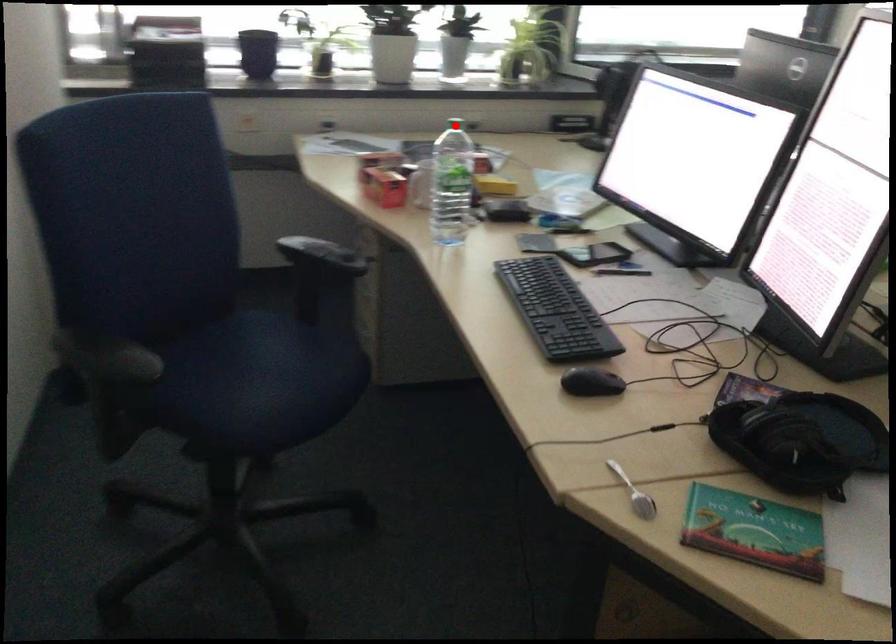
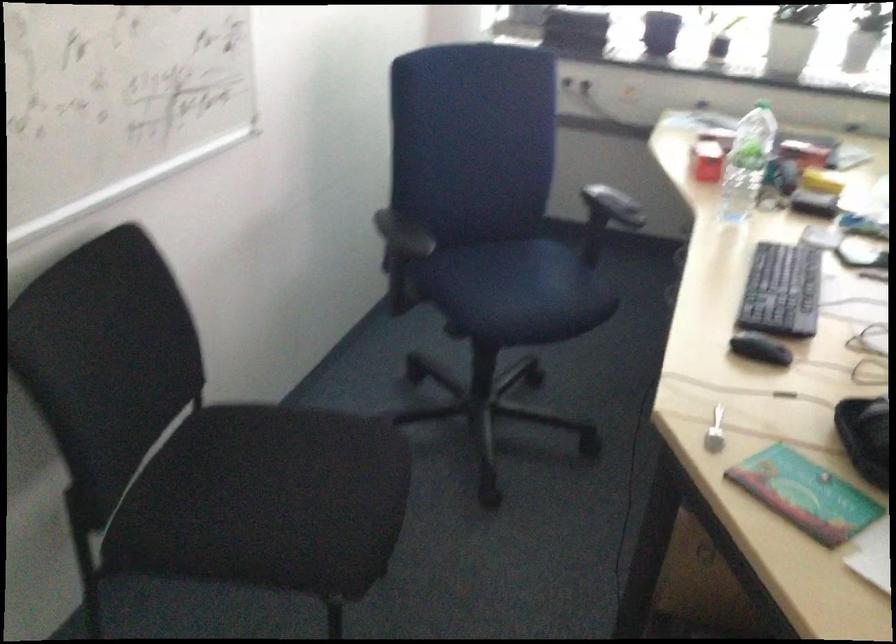
Question: I am providing you with two images of the same scene from different viewpoints. A red point is marked on the first image. Is the red point's position out of view in image 2?

Choices:
 (A) Yes
 (B) No

Answer: (B)